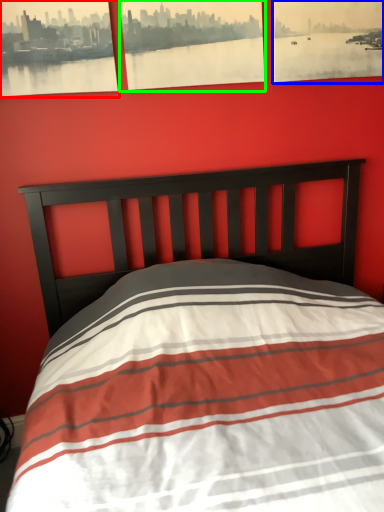
Question: Based on their relative distances, which object is farther from picture frame (highlighted by a red box)? Choose from picture frame (highlighted by a blue box) and picture frame (highlighted by a green box).

Choices:
 (A) picture frame
 (B) picture frame

Answer: (A)